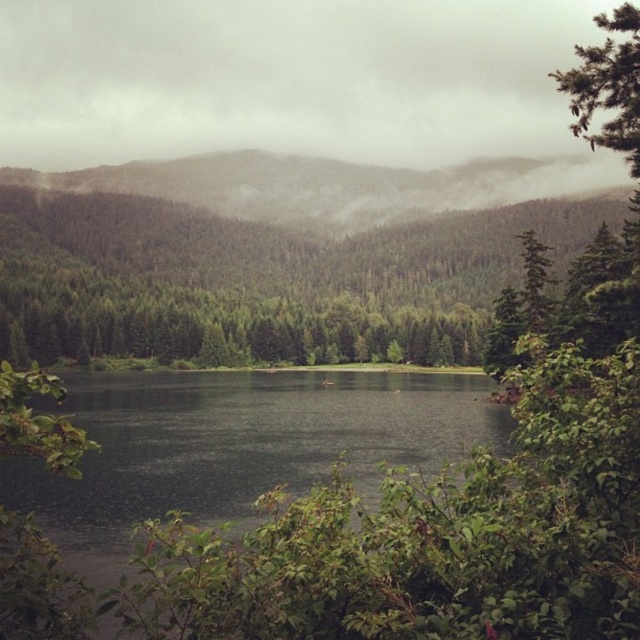
You are a hiker standing at the edge of the green matte forest at center and want to reach the green forested mountain at upper center. Given that your average walking speed is 3 km per hour, how long would it take you to walk directly between the two landmarks?

The distance between the green matte forest at center and the green forested mountain at upper center is 74.15 meters. At a walking speed of 3 km per hour, it would take approximately 0.025 hours, which is about 1.5 minutes, to walk directly between them.

You are standing in the serene natural landscape and want to take a photo of the green matte forest at center and the green forested mountain at upper center. Based on their positions, which object should you pan your camera to the right to capture first?

You should pan your camera to the right to capture the green matte forest at center first because it is positioned to the right of the green forested mountain at upper center.

You are standing at the edge of the lake and want to reach the green matte forest at center. According to the coordinates provided, in which direction should you head?

The green matte forest at center is located at coordinates point (260, 280). Since the y coordinate is lower than 0.5, it means it is positioned slightly north of the center. Therefore, you should head north to reach it.